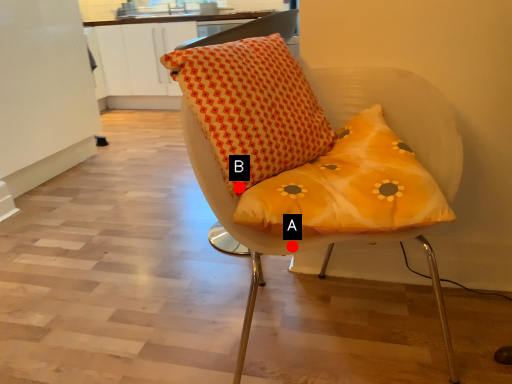
Question: Two points are circled on the image, labeled by A and B beside each circle. Which point is closer to the camera taking this photo?

Choices:
 (A) A is closer
 (B) B is closer

Answer: (A)